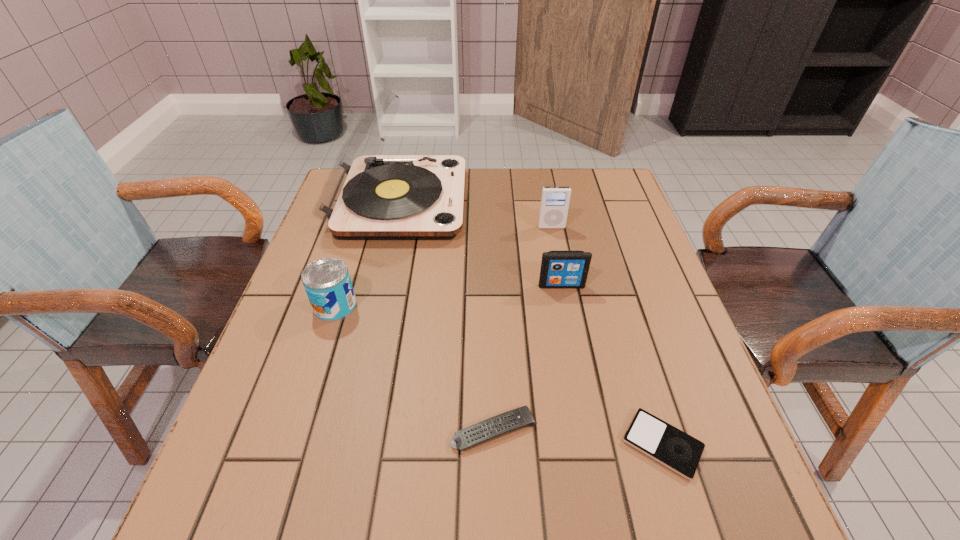
The image size is (960, 540). In order to click on vacant space that is in between the tallest object and the fifth tallest object in this screenshot , I will do `click(446, 316)`.

Locate an element on the screen. Image resolution: width=960 pixels, height=540 pixels. free space between the can and the rightmost iPod is located at coordinates (498, 375).

This screenshot has height=540, width=960. Identify the location of free space between the tallest object and the fourth farthest object. (367, 253).

Where is `vacant point located between the tallest object and the fifth shortest object`? This screenshot has width=960, height=540. vacant point located between the tallest object and the fifth shortest object is located at coordinates (475, 214).

This screenshot has height=540, width=960. What are the coordinates of `vacant region between the tallest object and the second shortest object` in the screenshot? It's located at (446, 316).

Locate an element on the screen. Image resolution: width=960 pixels, height=540 pixels. unoccupied area between the remote control and the second nearest iPod is located at coordinates (528, 357).

What are the coordinates of `object that stands as the closest to the tallest object` in the screenshot? It's located at (327, 282).

The image size is (960, 540). I want to click on object that is the second closest to the fourth nearest object, so point(366,196).

Point out which iPod is positioned as the second nearest to the fifth tallest object. Please provide its 2D coordinates. Your answer should be formatted as a tuple, i.e. [(x, y)], where the tuple contains the x and y coordinates of a point satisfying the conditions above.

[(559, 269)]

Where is `the closest iPod to the farthest iPod`? This screenshot has width=960, height=540. the closest iPod to the farthest iPod is located at coordinates (559, 269).